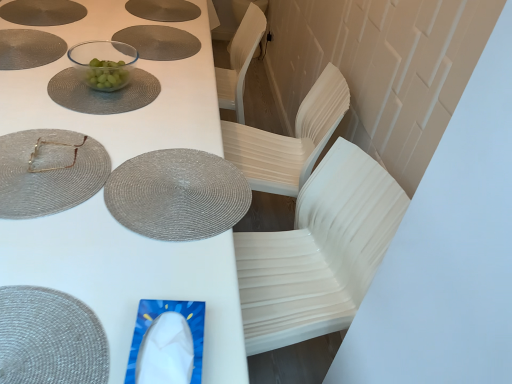
At what (x,y) coordinates should I click in order to perform the action: click on vacant region under matte gray placemat at upper center, which appears as the 2th plate when viewed from the left (from a real-world perspective). Please return your answer as a coordinate pair (x, y). The width and height of the screenshot is (512, 384). Looking at the image, I should click on (149, 39).